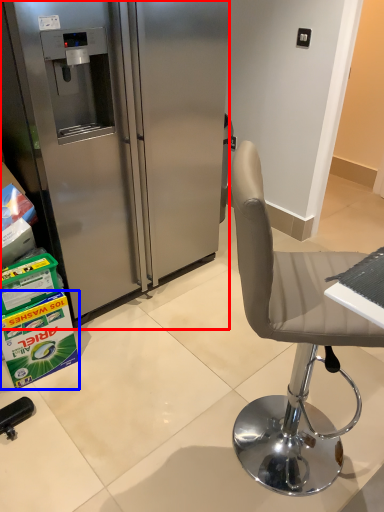
Question: Which of the following is the closest to the observer, refrigerator (highlighted by a red box) or box (highlighted by a blue box)?

Choices:
 (A) refrigerator
 (B) box

Answer: (A)